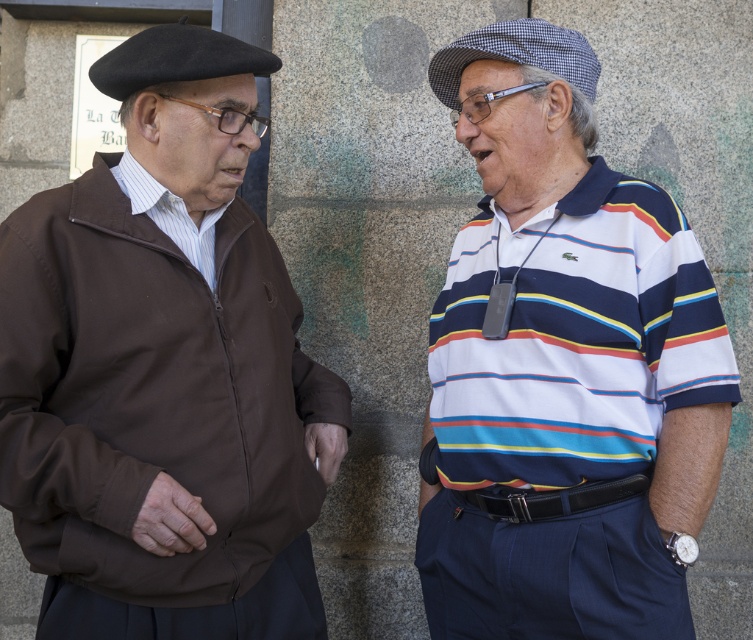
Question: Which point is farther to the camera?

Choices:
 (A) (258, 404)
 (B) (483, 492)

Answer: (B)

Question: Which point is closer to the camera taking this photo?

Choices:
 (A) (535, 234)
 (B) (270, 60)

Answer: (B)

Question: In this image, where is brown fabric jacket at left located relative to white striped polo shirt at center?

Choices:
 (A) above
 (B) below

Answer: (B)

Question: Is brown fabric jacket at left to the left of white striped polo shirt at center from the viewer's perspective?

Choices:
 (A) no
 (B) yes

Answer: (B)

Question: Can you confirm if brown fabric jacket at left is positioned above white striped polo shirt at center?

Choices:
 (A) yes
 (B) no

Answer: (B)